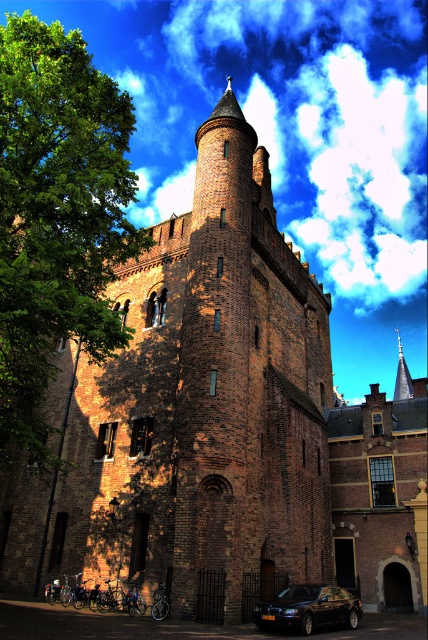
You are standing in front of the historic brick building and want to take a photo. There are two points marked on your camera screen at coordinates point (122, 106) and point (285, 627). Which point is closer to your camera lens?

Point (122, 106) is further to the camera than point (285, 627). Therefore, the point closer to the camera lens is point (285, 627).

You are a photographer planning to capture the historic brick building with its tower. You notice the green leafy tree at left and the shiny black car at lower center in your current view. To ensure the building remains the main focus, which object should you move closer to or further away from, and why?

You should move further away from the green leafy tree at left because it is larger in size than the shiny black car at lower center, which may be blocking the building or drawing attention away from the tower.

You are a photographer wanting to capture the historic brick tower without any obstructions. You are currently positioned where you can see both the green leafy tree at left and the shiny black car at lower center. Which object should you move away from to ensure the tower is fully visible?

The green leafy tree at left is in front of the shiny black car at lower center, so moving away from the green leafy tree at left would help eliminate the obstruction and allow the tower to be fully visible.